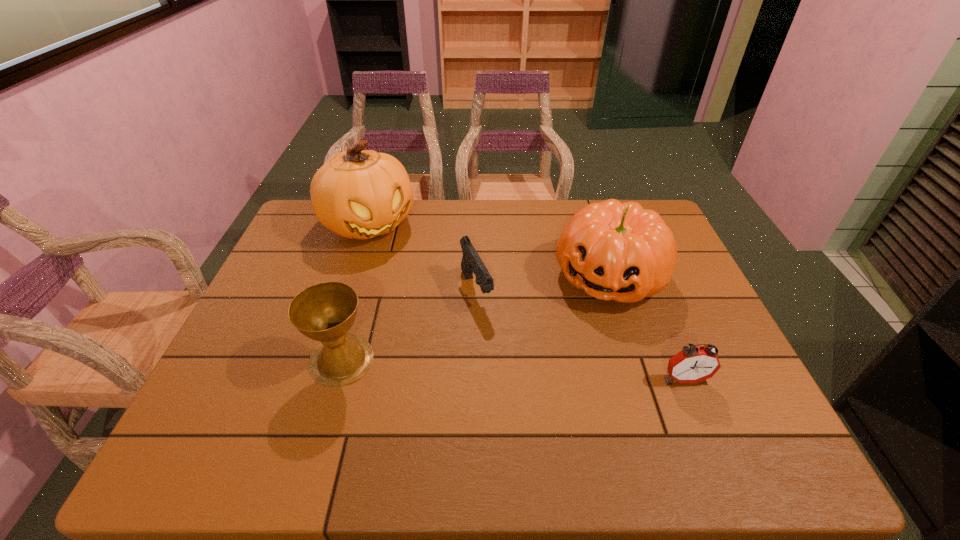
Where is `the third shortest object`? the third shortest object is located at coordinates (325, 312).

In order to click on alarm clock in this screenshot , I will do `click(693, 364)`.

Where is `the left pumpkin`? the left pumpkin is located at coordinates (356, 194).

At what (x,y) coordinates should I click in order to perform the action: click on the tallest object. Please return your answer as a coordinate pair (x, y). This screenshot has width=960, height=540. Looking at the image, I should click on (356, 194).

Where is `the shorter pumpkin`? Image resolution: width=960 pixels, height=540 pixels. the shorter pumpkin is located at coordinates (617, 251).

At what (x,y) coordinates should I click in order to perform the action: click on pistol. Please return your answer as a coordinate pair (x, y). Looking at the image, I should click on (471, 262).

You are a GUI agent. You are given a task and a screenshot of the screen. Output one action in this format:
    pyautogui.click(x=<x>, y=<y>)
    Task: Click on the free space located 0.350m on the back of the third tallest object
    The height and width of the screenshot is (540, 960).
    Given the screenshot: What is the action you would take?
    pyautogui.click(x=373, y=247)

Image resolution: width=960 pixels, height=540 pixels. What are the coordinates of `free region located 0.350m on the front face of the left pumpkin` in the screenshot? It's located at 448,318.

I want to click on vacant space located on the front face of the left pumpkin, so click(459, 330).

I want to click on vacant space located on the front face of the left pumpkin, so click(416, 279).